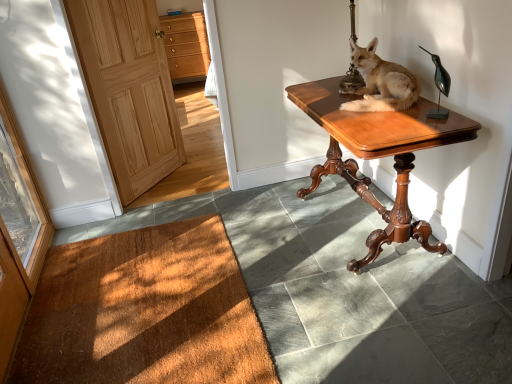
Where is `blank space situated above brown textured mat at lower left (from a real-world perspective)`? Image resolution: width=512 pixels, height=384 pixels. blank space situated above brown textured mat at lower left (from a real-world perspective) is located at coordinates (144, 295).